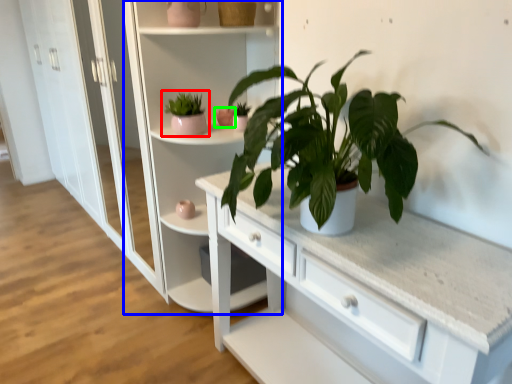
Question: Based on their relative distances, which object is farther from houseplant (highlighted by a red box)? Choose from bookshelf (highlighted by a blue box) and flowerpot (highlighted by a green box).

Choices:
 (A) bookshelf
 (B) flowerpot

Answer: (A)